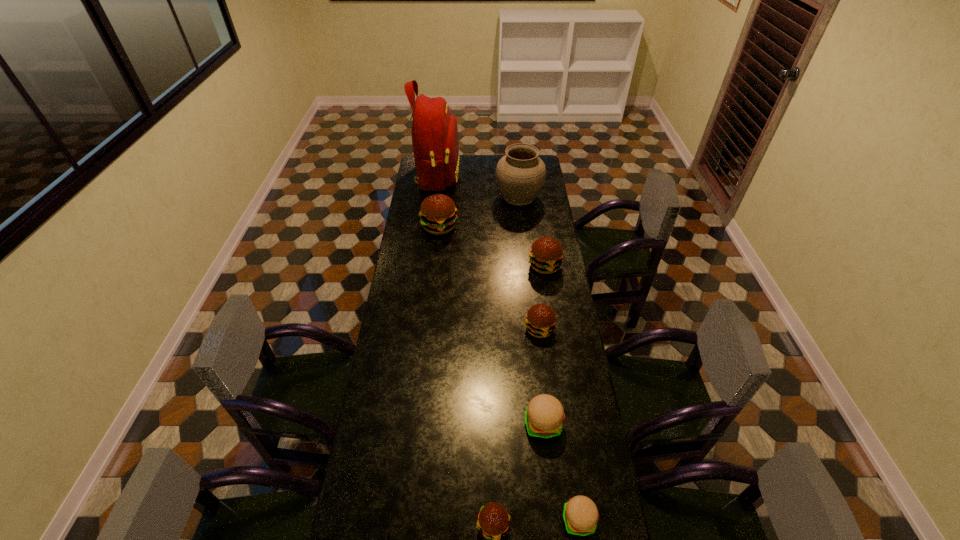
This screenshot has width=960, height=540. Identify the location of the tallest object. (435, 141).

Find the location of a particular element. Image resolution: width=960 pixels, height=540 pixels. pink backpack is located at coordinates pos(435,141).

Locate an element on the screen. Image resolution: width=960 pixels, height=540 pixels. urn is located at coordinates (520, 174).

Where is `the third farthest object`? This screenshot has width=960, height=540. the third farthest object is located at coordinates (438, 215).

Where is `the leftmost brown hamburger`? This screenshot has height=540, width=960. the leftmost brown hamburger is located at coordinates (438, 215).

You are a GUI agent. You are given a task and a screenshot of the screen. Output one action in this format:
    pyautogui.click(x=<x>, y=<y>)
    Task: Click on the fifth nearest object
    
    Given the screenshot: What is the action you would take?
    pyautogui.click(x=546, y=253)

Locate an element on the screen. the fifth shortest hamburger is located at coordinates (x=546, y=253).

Where is `the fourth nearest hamburger`? the fourth nearest hamburger is located at coordinates (540, 321).

Locate an element on the screen. This screenshot has width=960, height=540. the fifth farthest object is located at coordinates (540, 321).

Find the location of a particular element. The width and height of the screenshot is (960, 540). the fourth farthest hamburger is located at coordinates tap(544, 417).